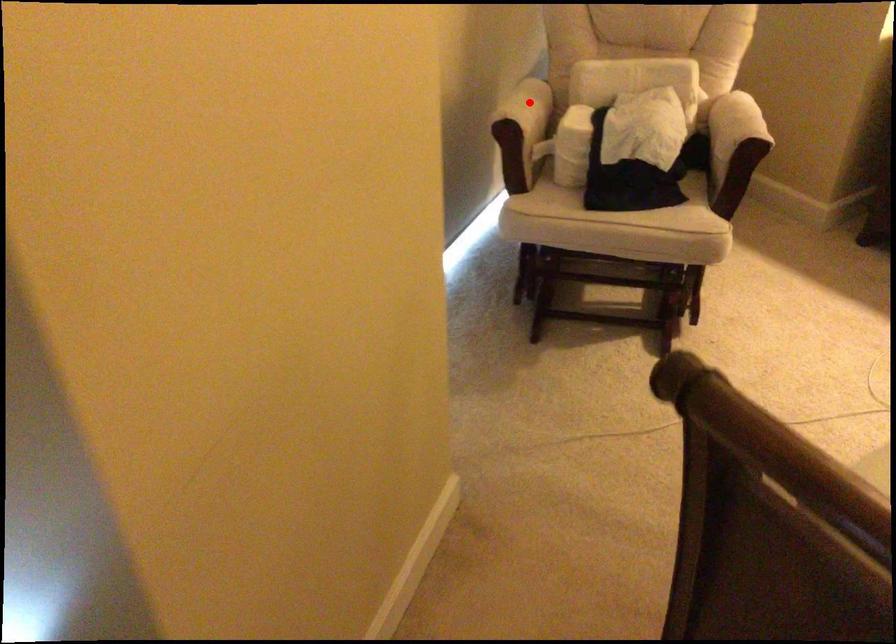
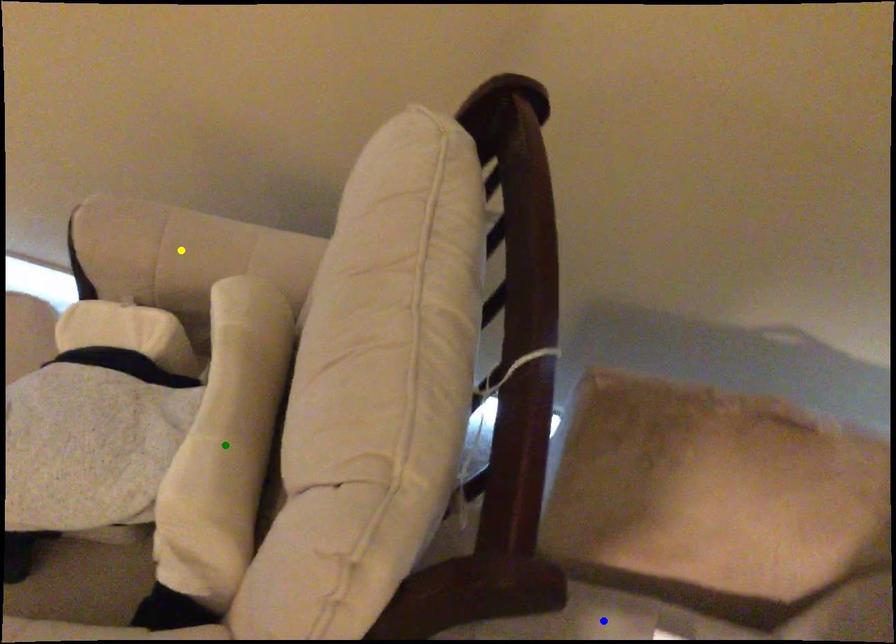
Question: I am providing you with two images of the same scene from different viewpoints. A red point is marked on the first image. You are given multiple points on the second image. Which mark in image 2 goes with the point in image 1?

Choices:
 (A) yellow point
 (B) blue point
 (C) green point

Answer: (A)